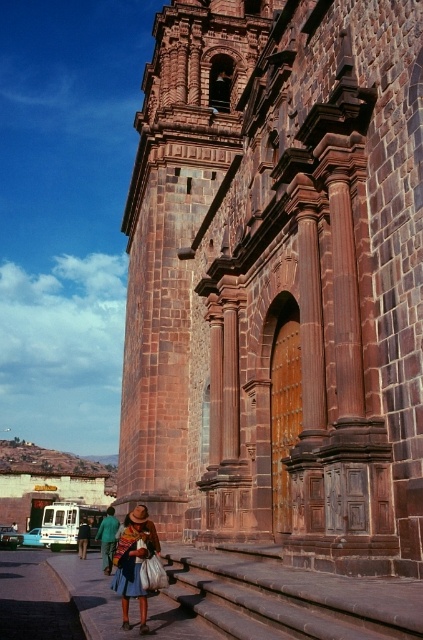
You are standing at the entrance of the brown stone church at center and want to go down to the brown stone stairs at lower center. Which direction should you face to move towards the stairs?

Since the brown stone stairs at lower center are located below the brown stone church at center, you should face downward or towards the lower part of the scene to move towards the stairs.

You are standing at the bottom of the brown stone stairs at lower center and want to reach the entrance of the brown stone church at center. Which direction should you walk to get closer to the church?

You should walk forward towards the brown stone church at center since it is directly ahead of you at the top of the stairs.

You are standing in front of the church and want to find the entrance. The scene has a point marked at coordinates (288, 596) which indicates brown stone stairs at lower center. Where are the brown stone stairs located in relation to the tall bell tower on the left?

The brown stone stairs at lower center are located to the right of the tall bell tower on the left, as the point marking them is at coordinates (288, 596) which is positioned to the right side of the tower.